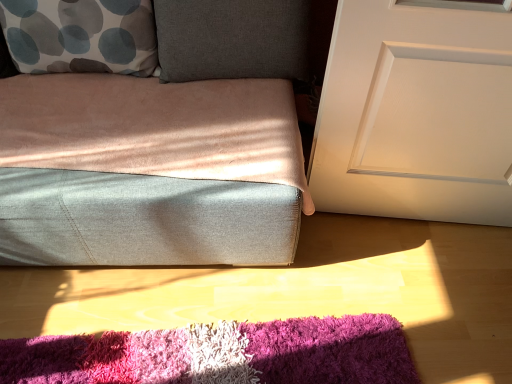
Question: Can you confirm if white matte door at right is thinner than dark gray fabric pillow at upper center?

Choices:
 (A) no
 (B) yes

Answer: (B)

Question: Is white matte door at right not close to dark gray fabric pillow at upper center?

Choices:
 (A) no
 (B) yes

Answer: (A)

Question: Is dark gray fabric pillow at upper center located within white matte door at right?

Choices:
 (A) no
 (B) yes

Answer: (A)

Question: Is white matte door at right outside dark gray fabric pillow at upper center?

Choices:
 (A) yes
 (B) no

Answer: (A)

Question: Is white matte door at right smaller than dark gray fabric pillow at upper center?

Choices:
 (A) no
 (B) yes

Answer: (A)

Question: Do you think white with gray and blue circles pillow at upper left is within dark gray fabric pillow at upper center, or outside of it?

Choices:
 (A) outside
 (B) inside

Answer: (A)

Question: Considering the positions of white with gray and blue circles pillow at upper left and dark gray fabric pillow at upper center in the image, is white with gray and blue circles pillow at upper left wider or thinner than dark gray fabric pillow at upper center?

Choices:
 (A) wide
 (B) thin

Answer: (A)

Question: Is white with gray and blue circles pillow at upper left in front of or behind dark gray fabric pillow at upper center in the image?

Choices:
 (A) front
 (B) behind

Answer: (A)

Question: From a real-world perspective, is white with gray and blue circles pillow at upper left physically located above or below dark gray fabric pillow at upper center?

Choices:
 (A) above
 (B) below

Answer: (B)

Question: Is shaggy multicolor rug at lower center taller or shorter than dark gray fabric pillow at upper center?

Choices:
 (A) short
 (B) tall

Answer: (A)

Question: Is shaggy multicolor rug at lower center to the left or to the right of dark gray fabric pillow at upper center in the image?

Choices:
 (A) right
 (B) left

Answer: (B)

Question: From a real-world perspective, is shaggy multicolor rug at lower center physically located above or below dark gray fabric pillow at upper center?

Choices:
 (A) below
 (B) above

Answer: (A)

Question: From the image's perspective, is shaggy multicolor rug at lower center located above or below dark gray fabric pillow at upper center?

Choices:
 (A) above
 (B) below

Answer: (B)

Question: Is point (494, 132) closer or farther from the camera than point (384, 382)?

Choices:
 (A) farther
 (B) closer

Answer: (A)

Question: From the image's perspective, is white matte door at right positioned above or below shaggy multicolor rug at lower center?

Choices:
 (A) above
 (B) below

Answer: (A)